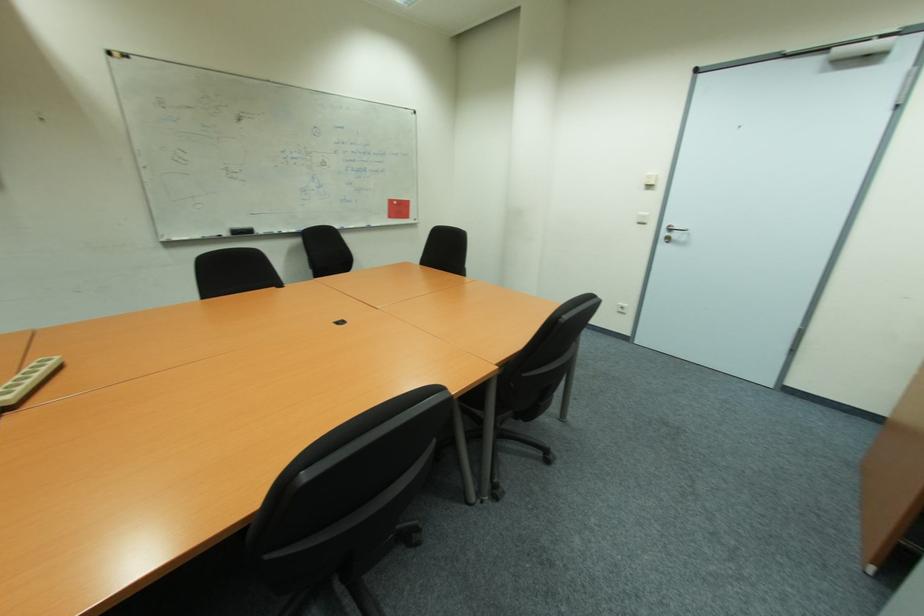
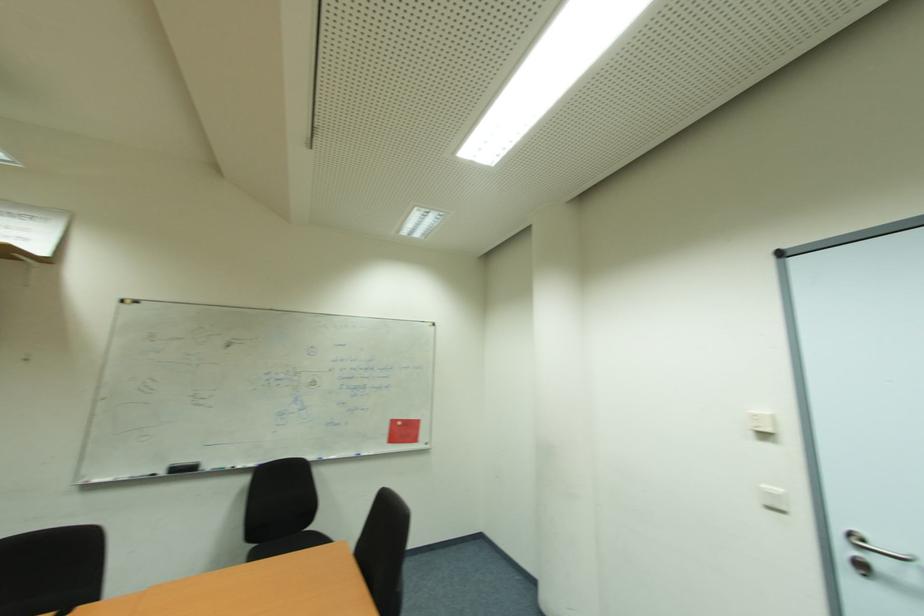
Locate, in the second image, the point that corresponds to [394,201] in the first image.

(397, 423)